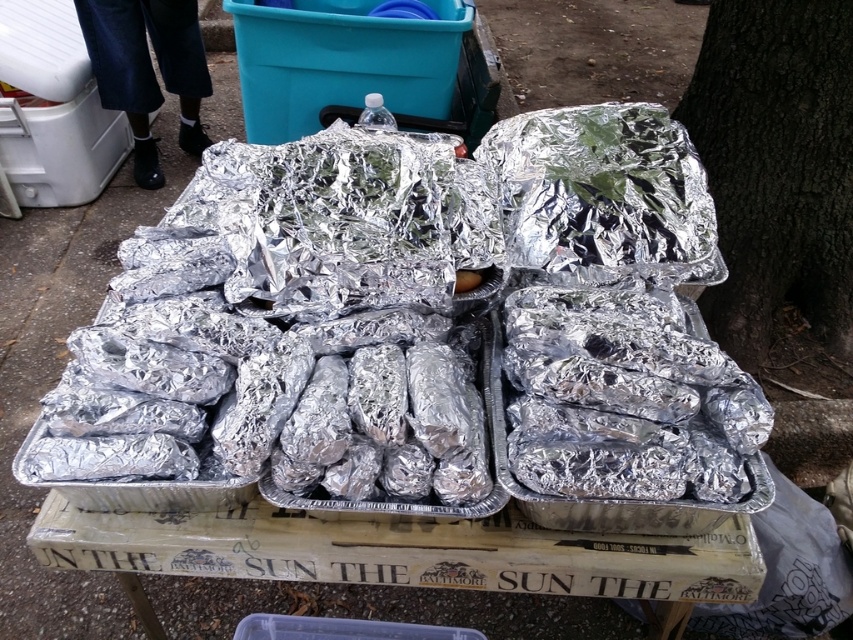
Is shiny metallic trays at center positioned behind dark brown textured bark at right?

No, it is not.

Who is higher up, shiny metallic trays at center or dark brown textured bark at right?

dark brown textured bark at right is higher up.

Who is more distant from viewer, (256, 396) or (782, 104)?

The point (782, 104) is more distant.

Locate an element on the screen. Image resolution: width=853 pixels, height=640 pixels. shiny metallic trays at center is located at coordinates pyautogui.click(x=416, y=324).